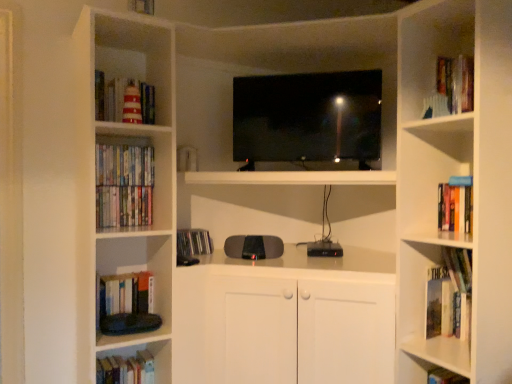
Based on the photo, what is the approximate height of hardcover book at lower right, arranged as the 1th book when viewed from the right?

It is 29.92 centimeters.

At what (x,y) coordinates should I click in order to perform the action: click on hardcover books at lower left, the 2th book from the bottom. Please return your answer as a coordinate pair (x, y). Looking at the image, I should click on (126, 369).

Describe the element at coordinates (124, 100) in the screenshot. I see `striped paper book at upper left, placed as the 7th book when sorted from bottom to top` at that location.

You are a GUI agent. You are given a task and a screenshot of the screen. Output one action in this format:
    pyautogui.click(x=<x>, y=<y>)
    Task: Click on the hardcover book at right, the 6th book in the left-to-right sequence
    The width and height of the screenshot is (512, 384).
    Given the screenshot: What is the action you would take?
    pyautogui.click(x=450, y=295)

This screenshot has height=384, width=512. What do you see at coordinates (308, 121) in the screenshot? I see `black glossy screen at center` at bounding box center [308, 121].

What is the approximate width of matte plastic dvds at left, placed as the 6th book when sorted from bottom to top?

It is 10.91 centimeters.

This screenshot has width=512, height=384. Identify the location of hardcover book at lower right, arranged as the 1th book when viewed from the right. (445, 377).

What's the angular difference between hardcover book at lower right, the 1th book ordered from the bottom, and black glossy screen at center's facing directions?

The angle between the facing direction of hardcover book at lower right, the 1th book ordered from the bottom, and the facing direction of black glossy screen at center is 46.9 degrees.

Locate an element on the screen. The height and width of the screenshot is (384, 512). the 4th book in front of the black glossy screen at center, counting from the anchor's position is located at coordinates (445, 377).

Considering the sizes of objects hardcover book at lower right, which ranks as the 7th book in left-to-right order, and black glossy screen at center in the image provided, who is bigger, hardcover book at lower right, which ranks as the 7th book in left-to-right order, or black glossy screen at center?

black glossy screen at center is bigger.

Relative to black glossy screen at center, is hardcover book at lower right, the 1th book ordered from the bottom, in front or behind?

Clearly, hardcover book at lower right, the 1th book ordered from the bottom, is in front of black glossy screen at center.

From the picture: Considering the sizes of objects hardcover book at right, acting as the 4th book starting from the top, and hardcover books at left, the 7th book from the right, in the image provided, who is shorter, hardcover book at right, acting as the 4th book starting from the top, or hardcover books at left, the 7th book from the right,?

Standing shorter between the two is hardcover books at left, the 7th book from the right.

From the image's perspective, which is below, hardcover book at right, the 6th book in the left-to-right sequence, or hardcover books at left, which is counted as the third book, starting from the top?

hardcover book at right, the 6th book in the left-to-right sequence, from the image's perspective.

From a real-world perspective, does hardcover book at right, the 2th book in the right-to-left sequence, stand above hardcover books at left, acting as the fifth book starting from the bottom?

Actually, hardcover book at right, the 2th book in the right-to-left sequence, is physically below hardcover books at left, acting as the fifth book starting from the bottom, in the real world.

Considering the relative positions of hardcover books at lower left, arranged as the fifth book when viewed from the right, and striped paper book at upper left, the first book viewed from the top, in the image provided, is hardcover books at lower left, arranged as the fifth book when viewed from the right, in front of striped paper book at upper left, the first book viewed from the top,?

No, the depth of hardcover books at lower left, arranged as the fifth book when viewed from the right, is greater than that of striped paper book at upper left, the first book viewed from the top.

Is hardcover books at lower left, arranged as the fifth book when viewed from the right, placed right next to striped paper book at upper left, which ranks as the 5th book in left-to-right order?

No.

From the image's perspective, which one is positioned higher, hardcover books at lower left, the 2th book from the bottom, or striped paper book at upper left, placed as the 7th book when sorted from bottom to top?

striped paper book at upper left, placed as the 7th book when sorted from bottom to top, from the image's perspective.

Is hardcover books at lower left, the 2th book from the bottom, facing away from striped paper book at upper left, the first book viewed from the top?

No.

Can you confirm if hardcover book at right, which is the 4th book in bottom-to-top order, is thinner than hardcover book at lower right, arranged as the 1th book when viewed from the right?

Correct, the width of hardcover book at right, which is the 4th book in bottom-to-top order, is less than that of hardcover book at lower right, arranged as the 1th book when viewed from the right.

From a real-world perspective, does hardcover book at right, which is the 4th book in bottom-to-top order, sit lower than hardcover book at lower right, the 7th book in the top-to-bottom sequence?

No, from a real-world perspective, hardcover book at right, which is the 4th book in bottom-to-top order, is not beneath hardcover book at lower right, the 7th book in the top-to-bottom sequence.

Is hardcover book at right, acting as the 4th book starting from the top, in front of hardcover book at lower right, arranged as the 1th book when viewed from the right?

No, hardcover book at right, acting as the 4th book starting from the top, is further to the viewer.

Between hardcover book at right, the 2th book in the right-to-left sequence, and hardcover book at lower right, the 1th book ordered from the bottom, which one has less height?

Standing shorter between the two is hardcover book at lower right, the 1th book ordered from the bottom.

From the picture: Are hardcover book at left, which is the 5th book from top to bottom, and matte plastic dvds at left, arranged as the 2th book when viewed from the top, beside each other?

No, hardcover book at left, which is the 5th book from top to bottom, is not with matte plastic dvds at left, arranged as the 2th book when viewed from the top.

Between hardcover book at left, which ranks as the fourth book in right-to-left order, and matte plastic dvds at left, placed as the 6th book when sorted from bottom to top, which one has less height?

matte plastic dvds at left, placed as the 6th book when sorted from bottom to top, is shorter.

Between point (138, 304) and point (136, 183), which one is positioned behind?

The point (138, 304) is more distant.

From the image's perspective, is hardcover book at left, which is the 5th book from top to bottom, located above or below matte plastic dvds at left, arranged as the 2th book when viewed from the top?

Clearly, from the image's perspective, hardcover book at left, which is the 5th book from top to bottom, is below matte plastic dvds at left, arranged as the 2th book when viewed from the top.

Which is more to the left, hardcover book at lower right, arranged as the 1th book when viewed from the right, or striped paper book at upper left, which ranks as the 5th book in left-to-right order?

striped paper book at upper left, which ranks as the 5th book in left-to-right order.

Is striped paper book at upper left, acting as the 3th book starting from the right, inside hardcover book at lower right, the 1th book ordered from the bottom?

That's incorrect, striped paper book at upper left, acting as the 3th book starting from the right, is not inside hardcover book at lower right, the 1th book ordered from the bottom.

Could you tell me if hardcover book at lower right, arranged as the 1th book when viewed from the right, is turned towards striped paper book at upper left, placed as the 7th book when sorted from bottom to top?

No, hardcover book at lower right, arranged as the 1th book when viewed from the right, is not facing towards striped paper book at upper left, placed as the 7th book when sorted from bottom to top.

Is hardcover book at lower right, the 7th book in the top-to-bottom sequence, smaller than striped paper book at upper left, the first book viewed from the top?

Indeed, hardcover book at lower right, the 7th book in the top-to-bottom sequence, has a smaller size compared to striped paper book at upper left, the first book viewed from the top.

Is striped paper book at upper left, acting as the 3th book starting from the right, in contact with hardcover book at left, which is the 5th book from top to bottom?

striped paper book at upper left, acting as the 3th book starting from the right, and hardcover book at left, which is the 5th book from top to bottom, are clearly separated.

From a real-world perspective, is striped paper book at upper left, placed as the 7th book when sorted from bottom to top, physically below hardcover book at left, placed as the fourth book when sorted from left to right?

No, from a real-world perspective, striped paper book at upper left, placed as the 7th book when sorted from bottom to top, is not under hardcover book at left, placed as the fourth book when sorted from left to right.

How many degrees apart are the facing directions of striped paper book at upper left, acting as the 3th book starting from the right, and hardcover book at left, placed as the fourth book when sorted from left to right?

The angular difference between striped paper book at upper left, acting as the 3th book starting from the right, and hardcover book at left, placed as the fourth book when sorted from left to right, is 0.00195 degrees.

Based on the photo, is striped paper book at upper left, the first book viewed from the top, positioned with its back to hardcover book at left, which is the 5th book from top to bottom?

No, striped paper book at upper left, the first book viewed from the top, is not facing the opposite direction of hardcover book at left, which is the 5th book from top to bottom.

You are a GUI agent. You are given a task and a screenshot of the screen. Output one action in this format:
    pyautogui.click(x=<x>, y=<y>)
    Task: Click on the television that appears behind the hardcover book at lower right, the 7th book in the top-to-bottom sequence
    This screenshot has width=512, height=384.
    Given the screenshot: What is the action you would take?
    pyautogui.click(x=308, y=121)

You are a GUI agent. You are given a task and a screenshot of the screen. Output one action in this format:
    pyautogui.click(x=<x>, y=<y>)
    Task: Click on the 5th book to the right of the hardcover books at left, which is counted as the third book, starting from the top, starting your count from the anchor
    This screenshot has height=384, width=512.
    Given the screenshot: What is the action you would take?
    pyautogui.click(x=450, y=295)

Based on their spatial positions, is hardcover book at lower right, which ranks as the 7th book in left-to-right order, or black glossy screen at center further from hardcover books at left, acting as the fifth book starting from the bottom?

Among the two, hardcover book at lower right, which ranks as the 7th book in left-to-right order, is located further to hardcover books at left, acting as the fifth book starting from the bottom.

Looking at the image, which one is located further to black glossy screen at center, hardcover books at left, which is the 1th book from left to right, or hardcover book at right, acting as the 4th book starting from the top?

hardcover book at right, acting as the 4th book starting from the top, is further to black glossy screen at center.

When comparing their distances from black glossy screen at center, does hardcover book at right, which is the 4th book in bottom-to-top order, or hardcover book at left, which is the 3th book from bottom to top, seem further?

hardcover book at left, which is the 3th book from bottom to top, is further to black glossy screen at center.

Based on their spatial positions, is black glossy screen at center or matte plastic dvds at left, positioned as the sixth book in right-to-left order, further from striped paper book at upper left, placed as the 7th book when sorted from bottom to top?

black glossy screen at center lies further to striped paper book at upper left, placed as the 7th book when sorted from bottom to top, than the other object.

Looking at the image, which one is located closer to striped paper book at upper left, the first book viewed from the top, hardcover books at left, acting as the fifth book starting from the bottom, or hardcover books at lower left, the 2th book from the bottom?

Among the two, hardcover books at left, acting as the fifth book starting from the bottom, is located nearer to striped paper book at upper left, the first book viewed from the top.

Which object lies further to the anchor point hardcover book at left, placed as the fourth book when sorted from left to right, hardcover books at lower left, marked as the 3th book in a left-to-right arrangement, or black glossy screen at center?

Among the two, black glossy screen at center is located further to hardcover book at left, placed as the fourth book when sorted from left to right.

Estimate the real-world distances between objects in this image. Which object is closer to hardcover book at left, placed as the fourth book when sorted from left to right, hardcover book at right, the 6th book in the left-to-right sequence, or matte plastic dvds at left, arranged as the 2th book when viewed from the top?

matte plastic dvds at left, arranged as the 2th book when viewed from the top, is positioned closer to the anchor hardcover book at left, placed as the fourth book when sorted from left to right.

Considering their positions, is black glossy screen at center positioned further to hardcover book at left, which is the 5th book from top to bottom, than hardcover books at lower left, marked as the 3th book in a left-to-right arrangement?

black glossy screen at center is positioned further to the anchor hardcover book at left, which is the 5th book from top to bottom.

At what (x,y) coordinates should I click in order to perform the action: click on television between matte plastic dvds at left, placed as the 6th book when sorted from bottom to top, and hardcover book at right, acting as the 4th book starting from the top, from left to right. Please return your answer as a coordinate pair (x, y). Looking at the image, I should click on (308, 121).

Locate an element on the screen. This screenshot has height=384, width=512. book between striped paper book at upper left, acting as the 3th book starting from the right, and hardcover book at lower right, the 7th book in the top-to-bottom sequence, in the horizontal direction is located at coordinates (450, 295).

Where is `television located between striped paper book at upper left, which ranks as the 5th book in left-to-right order, and hardcover book at right, acting as the 4th book starting from the top, in the left-right direction`? television located between striped paper book at upper left, which ranks as the 5th book in left-to-right order, and hardcover book at right, acting as the 4th book starting from the top, in the left-right direction is located at coordinates (308, 121).

I want to click on television between striped paper book at upper left, placed as the 7th book when sorted from bottom to top, and hardcover book at lower right, arranged as the 1th book when viewed from the right, vertically, so click(308, 121).